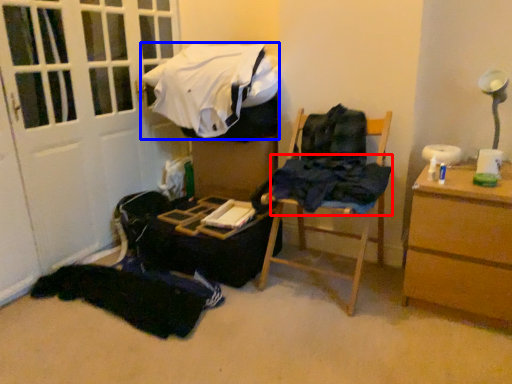
Question: Among these objects, which one is farthest to the camera, clothing (highlighted by a red box) or clothing (highlighted by a blue box)?

Choices:
 (A) clothing
 (B) clothing

Answer: (B)